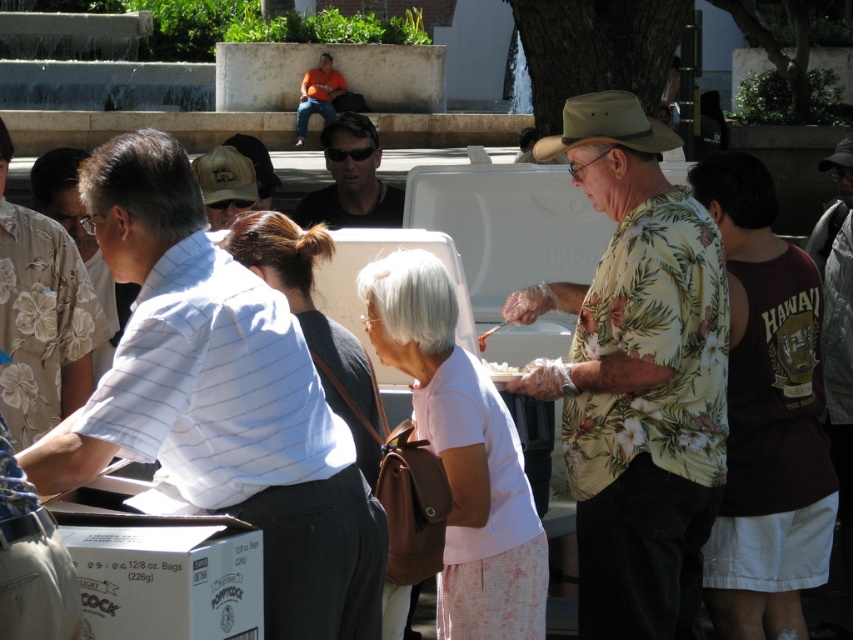
You are a photographer at the event and want to capture a photo of both the floral print shirt at center and the matte black shirt at center. Which shirt should you focus on first to ensure both are in the frame?

The floral print shirt at center is to the right of the matte black shirt at center, so you should focus on the matte black shirt at center first to ensure both are in the frame.

You are standing at the fountain in the background and want to take a photo of both the point at coordinates point (167, 532) and point (225, 221). Which point should you focus on first to ensure both are in focus?

You should focus on point (225, 221) first because it is farther from the camera compared to point (167, 532). This way, the depth of field will cover both points effectively.